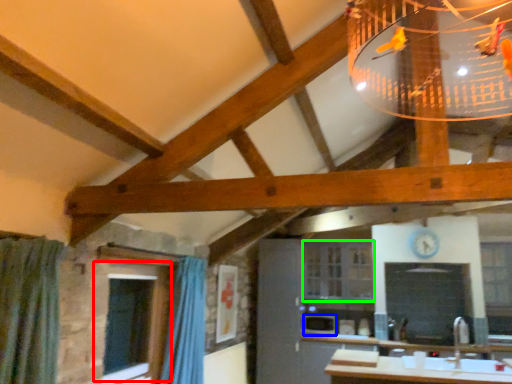
Question: Based on their relative distances, which object is nearer to window (highlighted by a red box)? Choose from appliance (highlighted by a blue box) and window (highlighted by a green box).

Choices:
 (A) appliance
 (B) window

Answer: (A)